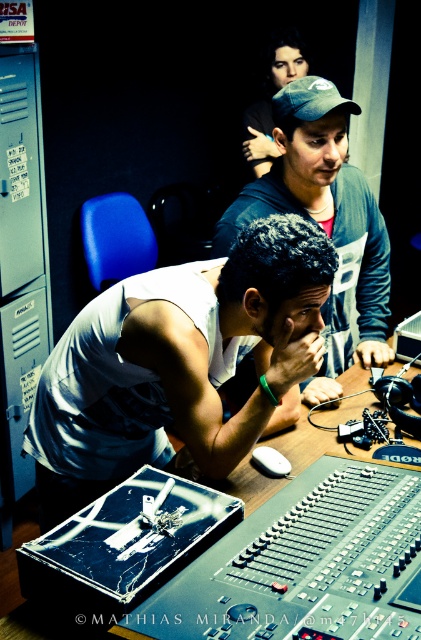
Question: Which object appears farthest from the camera in this image?

Choices:
 (A) white matte tank top at center
 (B) matte blue cap at center

Answer: (B)

Question: Is white matte tank top at center positioned at the back of matte blue cap at center?

Choices:
 (A) no
 (B) yes

Answer: (A)

Question: Which of the following is the closest to the observer?

Choices:
 (A) (349, 225)
 (B) (288, 273)

Answer: (B)

Question: Does white matte tank top at center appear on the right side of matte blue cap at center?

Choices:
 (A) yes
 (B) no

Answer: (B)

Question: Does white matte tank top at center appear over matte blue cap at center?

Choices:
 (A) no
 (B) yes

Answer: (A)

Question: Among these points, which one is farthest from the camera?

Choices:
 (A) (359, 356)
 (B) (191, 268)

Answer: (A)